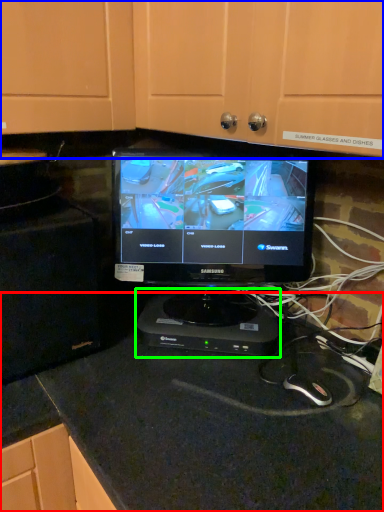
Question: Considering the real-world distances, which object is farthest from counter top (highlighted by a red box)? dresser (highlighted by a blue box) or appliance (highlighted by a green box)?

Choices:
 (A) dresser
 (B) appliance

Answer: (A)